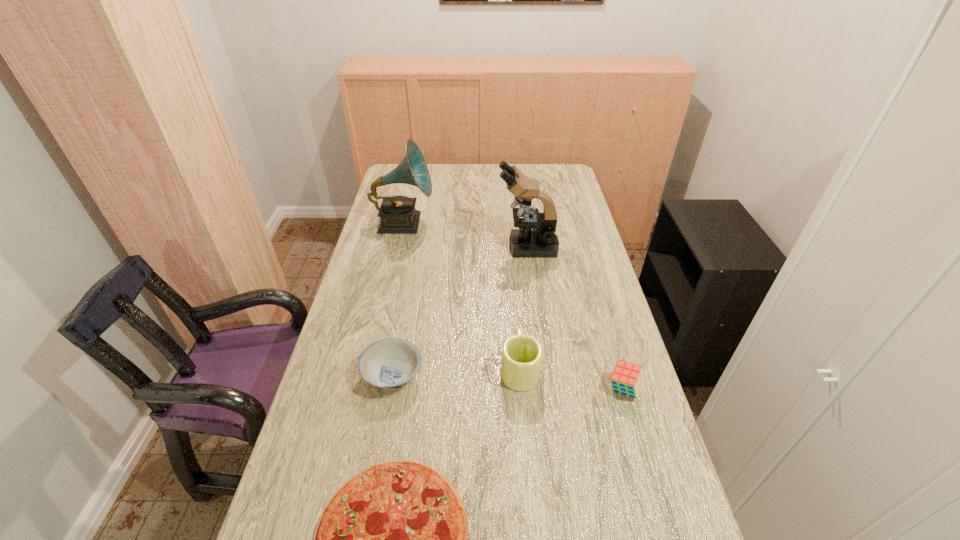
What are the coordinates of `vacant space at the far right corner of the desktop` in the screenshot? It's located at (563, 170).

Image resolution: width=960 pixels, height=540 pixels. I want to click on vacant space in between the fifth tallest object and the phonograph_record, so click(x=398, y=300).

The image size is (960, 540). I want to click on free space between the mug and the phonograph_record, so click(x=462, y=296).

At what (x,y) coordinates should I click in order to perform the action: click on unoccupied area between the mug and the third shortest object. Please return your answer as a coordinate pair (x, y). The image size is (960, 540). Looking at the image, I should click on (572, 379).

Where is `unoccupied area between the microscope and the cube`? This screenshot has width=960, height=540. unoccupied area between the microscope and the cube is located at coordinates (575, 318).

Identify the location of vacant area that lies between the microscope and the third shortest object. (575, 318).

Select which object appears as the third closest to the second shortest object. Please provide its 2D coordinates. Your answer should be formatted as a tuple, i.e. [(x, y)], where the tuple contains the x and y coordinates of a point satisfying the conditions above.

[(536, 237)]

Identify which object is the third nearest to the cube. Please provide its 2D coordinates. Your answer should be formatted as a tuple, i.e. [(x, y)], where the tuple contains the x and y coordinates of a point satisfying the conditions above.

[(389, 364)]

Find the location of a particular element. free spot that satisfies the following two spatial constraints: 1. from the horn of the phonograph_record; 2. with the handle on the side of the fourth shortest object is located at coordinates (370, 368).

Locate an element on the screen. The width and height of the screenshot is (960, 540). vacant space that satisfies the following two spatial constraints: 1. from the horn of the phonograph_record; 2. on the back side of the third shortest object is located at coordinates (365, 389).